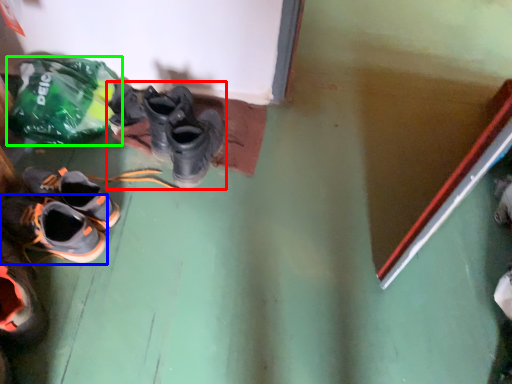
Question: Which object is the farthest from footwear (highlighted by a red box)? Choose among these: shoe (highlighted by a blue box) or plastic bag (highlighted by a green box).

Choices:
 (A) shoe
 (B) plastic bag

Answer: (A)